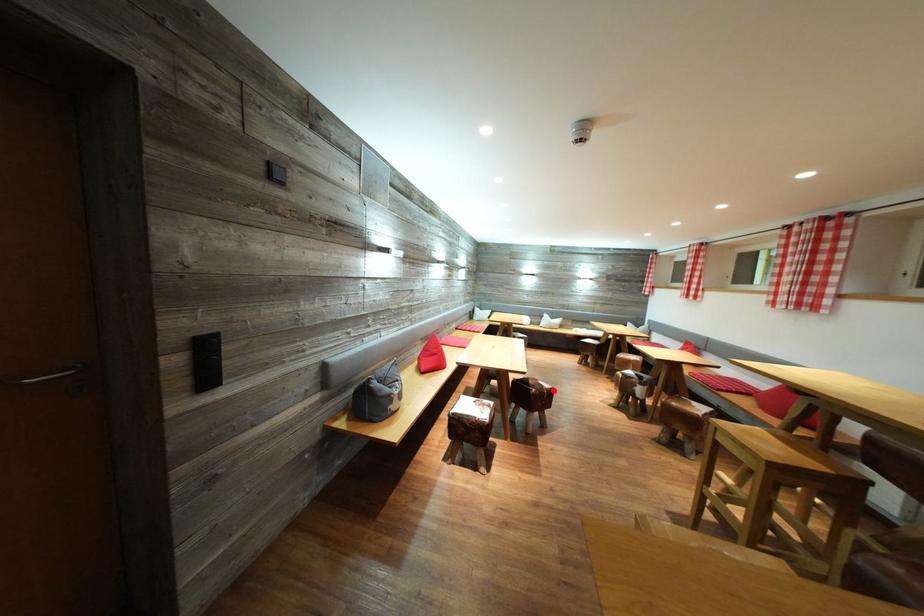
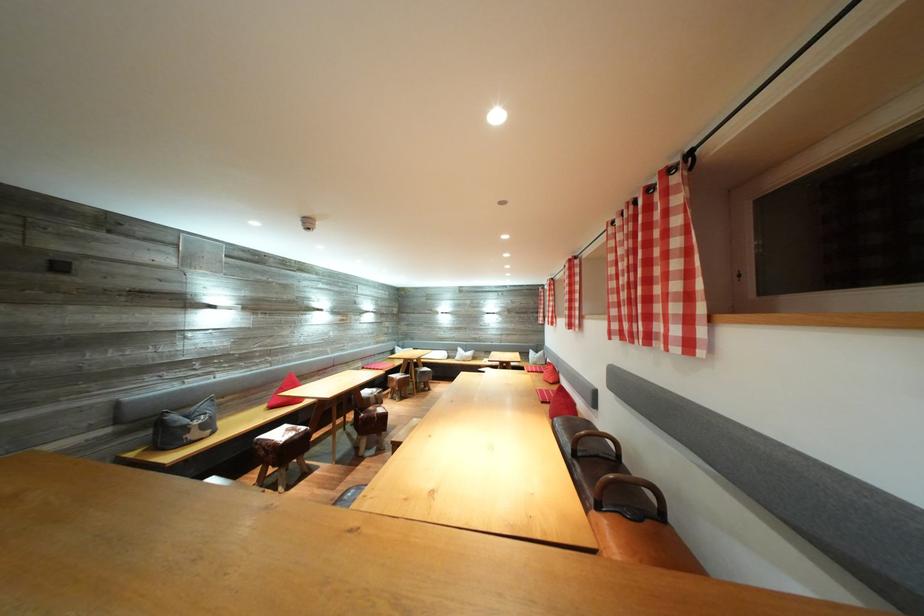
Locate, in the second image, the point that corresponds to the highlighted location in the first image.

(386, 416)